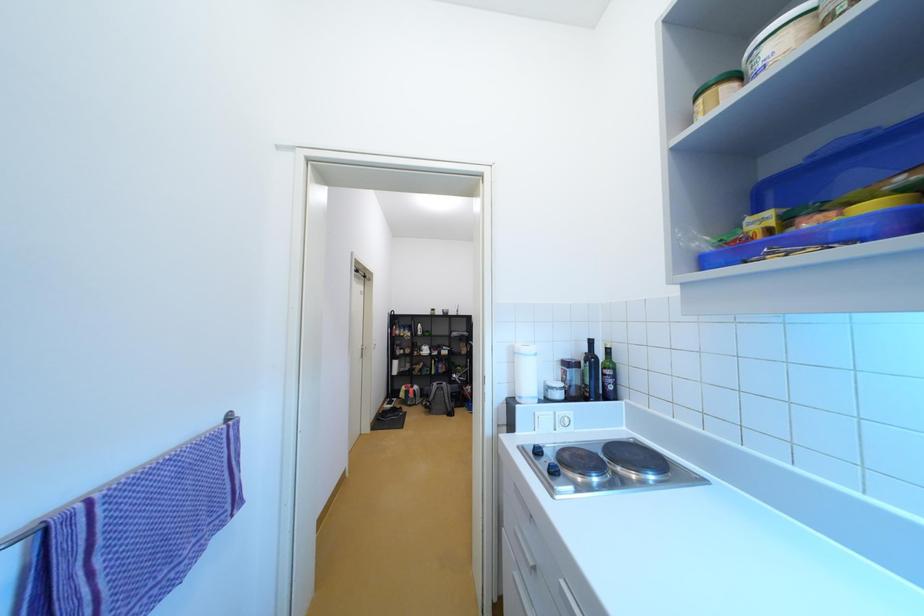
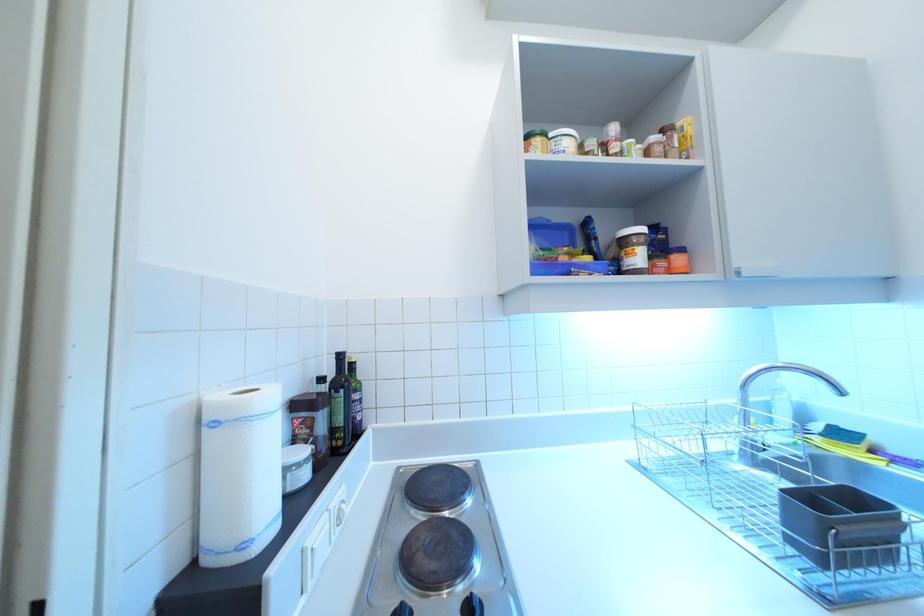
Question: The images are taken continuously from a first-person perspective. In which direction is your viewpoint rotating?

Choices:
 (A) Left
 (B) Right
 (C) Up
 (D) Down

Answer: (B)